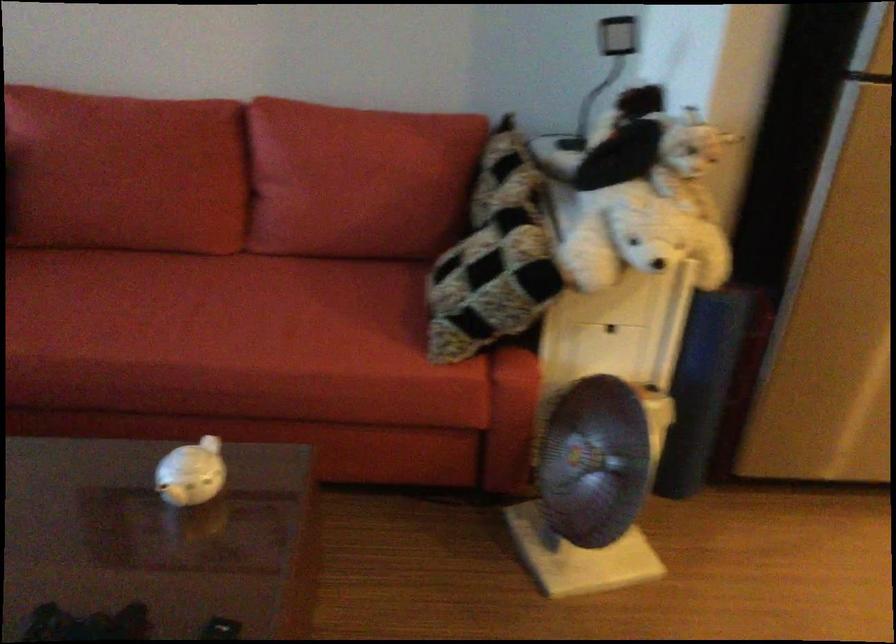
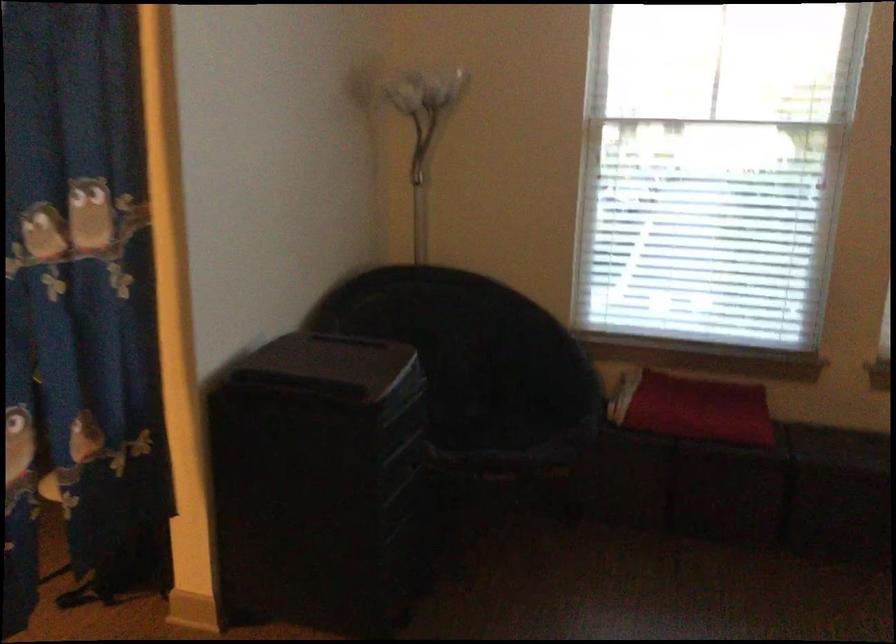
The first image is from the beginning of the video and the second image is from the end. How did the camera likely rotate when shooting the video?

The camera's rotation is toward left-down.